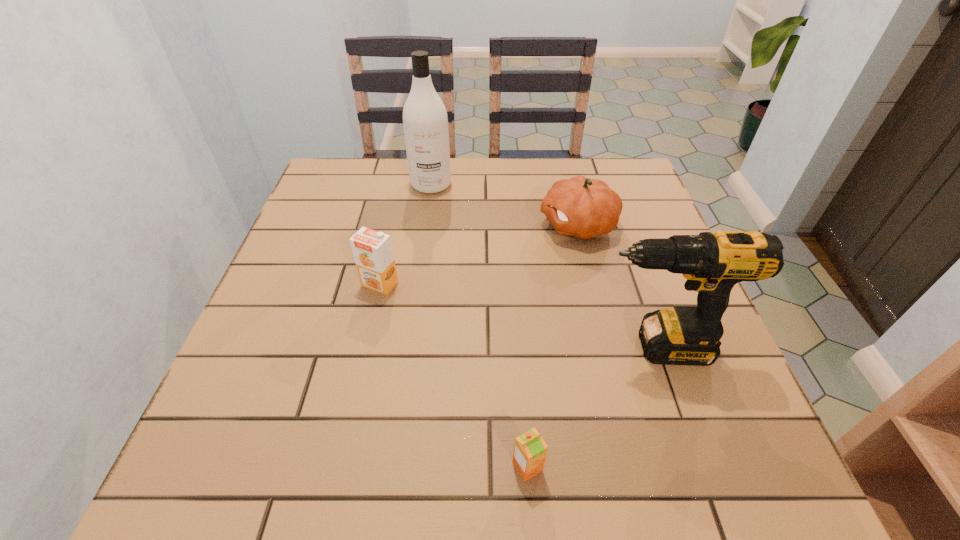
Locate an element on the screen. Image resolution: width=960 pixels, height=540 pixels. vacant space that's between the tallest object and the nearer orange juice is located at coordinates [x=479, y=326].

Where is `vacant region between the taller orange juice and the third object from right to left`? The height and width of the screenshot is (540, 960). vacant region between the taller orange juice and the third object from right to left is located at coordinates (454, 375).

Identify the location of unoccupied position between the pumpkin and the drill. (616, 286).

What are the coordinates of `vacant point located between the fourth nearest object and the taller orange juice` in the screenshot? It's located at (479, 254).

The width and height of the screenshot is (960, 540). What are the coordinates of `unoccupied area between the second farthest object and the tallest object` in the screenshot? It's located at (505, 205).

Where is `vacant space that is in between the shampoo and the farther orange juice`? vacant space that is in between the shampoo and the farther orange juice is located at coordinates (405, 234).

You are a GUI agent. You are given a task and a screenshot of the screen. Output one action in this format:
    pyautogui.click(x=<x>, y=<y>)
    Task: Click on the free space that is in between the tallest object and the shorter orange juice
    
    Given the screenshot: What is the action you would take?
    pyautogui.click(x=479, y=326)

The height and width of the screenshot is (540, 960). I want to click on free spot between the second tallest object and the pumpkin, so click(616, 286).

Find the location of a particular element. Image resolution: width=960 pixels, height=540 pixels. vacant area that lies between the farthest object and the third object from right to left is located at coordinates (479, 326).

Where is `vacant point located between the farthest object and the third object from right to left`? vacant point located between the farthest object and the third object from right to left is located at coordinates (x=479, y=326).